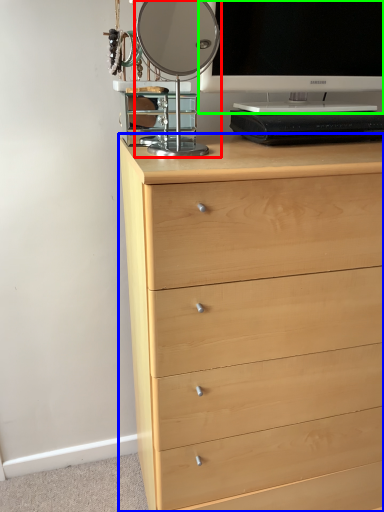
Question: Which is farther away from table lamp (highlighted by a red box)? chest of drawers (highlighted by a blue box) or television (highlighted by a green box)?

Choices:
 (A) chest of drawers
 (B) television

Answer: (A)